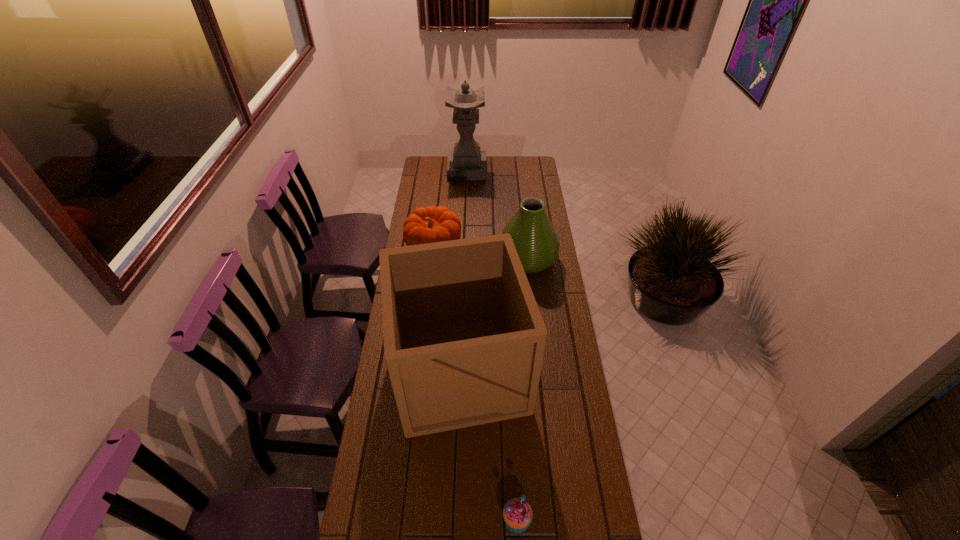
Identify the location of free region located 0.200m on the left of the third shortest object. This screenshot has width=960, height=540. pyautogui.click(x=455, y=259).

Locate an element on the screen. The height and width of the screenshot is (540, 960). vacant position located on the right of the pumpkin is located at coordinates (503, 247).

The width and height of the screenshot is (960, 540). I want to click on free space located 0.310m on the left of the muffin, so click(396, 519).

At what (x,y) coordinates should I click in order to perform the action: click on object that is at the far edge. Please return your answer as a coordinate pair (x, y). Image resolution: width=960 pixels, height=540 pixels. Looking at the image, I should click on (466, 162).

Image resolution: width=960 pixels, height=540 pixels. Identify the location of box positioned at the left edge. (464, 340).

Identify the location of pumpkin that is at the left edge. The image size is (960, 540). (431, 224).

At what (x,y) coordinates should I click in order to perform the action: click on object at the right edge. Please return your answer as a coordinate pair (x, y). Looking at the image, I should click on (534, 236).

In the image, there is a desktop. Where is `free space at the far edge`? This screenshot has width=960, height=540. free space at the far edge is located at coordinates (499, 165).

This screenshot has width=960, height=540. Find the location of `free space at the left edge of the desktop`. free space at the left edge of the desktop is located at coordinates (391, 429).

Locate an element on the screen. vacant space at the right edge of the desktop is located at coordinates (547, 370).